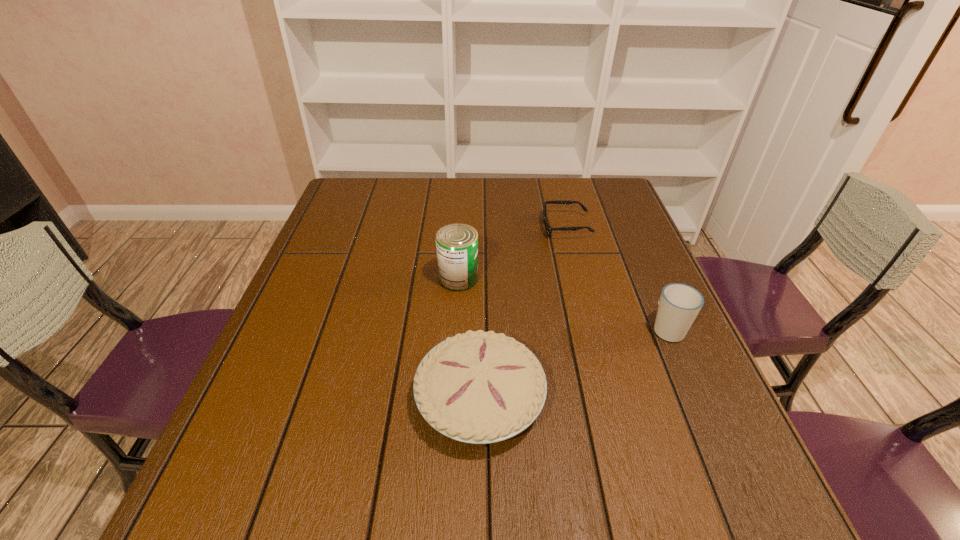
In the image, there is a desktop. What are the coordinates of `free space at the far edge` in the screenshot? It's located at (490, 188).

What are the coordinates of `vacant space at the near edge` in the screenshot? It's located at (428, 487).

In the image, there is a desktop. Where is `vacant space at the left edge`? This screenshot has width=960, height=540. vacant space at the left edge is located at coordinates (282, 390).

Where is `free space at the right edge of the desktop`? This screenshot has height=540, width=960. free space at the right edge of the desktop is located at coordinates (608, 237).

Locate an element on the screen. free space at the far left corner is located at coordinates (373, 217).

The height and width of the screenshot is (540, 960). I want to click on vacant space at the near left corner, so click(x=263, y=529).

In the image, there is a desktop. Where is `free region at the far right corner`? The width and height of the screenshot is (960, 540). free region at the far right corner is located at coordinates (576, 189).

Locate an element on the screen. The image size is (960, 540). vacant space that is in between the second nearest object and the second shortest object is located at coordinates (x=574, y=363).

At what (x,y) coordinates should I click in order to perform the action: click on free space between the third farthest object and the nearest object. Please return your answer as a coordinate pair (x, y). This screenshot has width=960, height=540. Looking at the image, I should click on (574, 363).

Locate an element on the screen. Image resolution: width=960 pixels, height=540 pixels. unoccupied area between the second shortest object and the third shortest object is located at coordinates (574, 363).